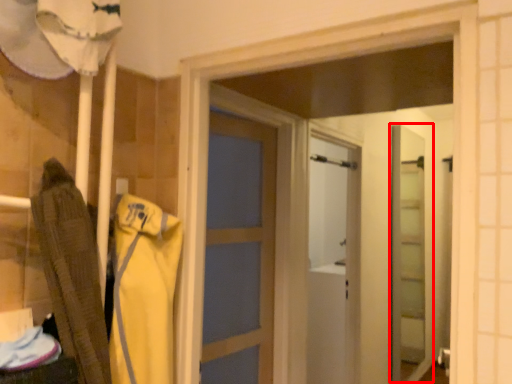
Question: Observing the image, what is the correct spatial positioning of screen door (annotated by the red box) in reference to clothing?

Choices:
 (A) left
 (B) right

Answer: (B)